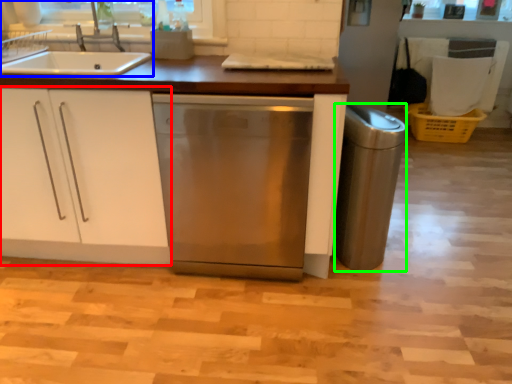
Question: Which object is the farthest from cabinetry (highlighted by a red box)? Choose among these: kitchen appliance (highlighted by a blue box) or appliance (highlighted by a green box).

Choices:
 (A) kitchen appliance
 (B) appliance

Answer: (B)